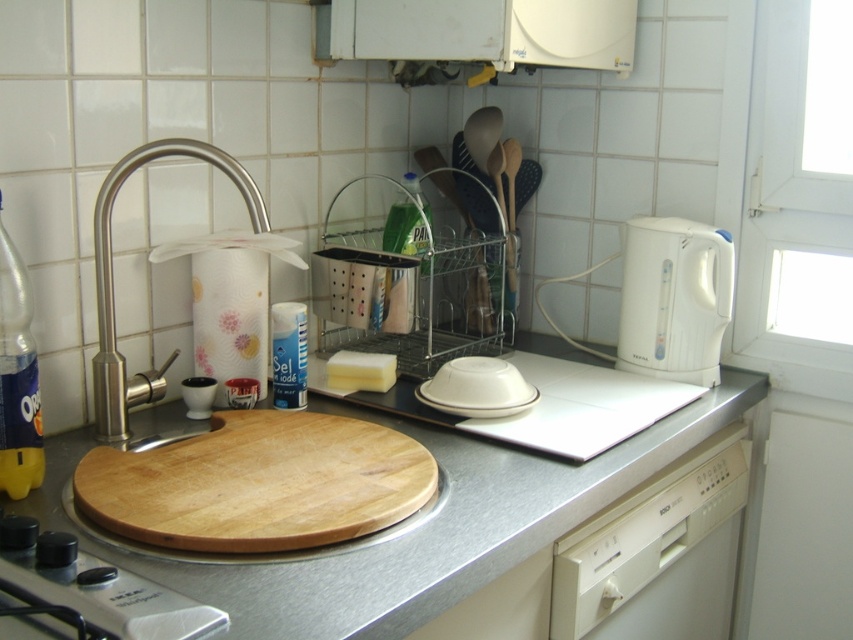
Question: Which of the following is the closest to the observer?

Choices:
 (A) white glossy plate at center
 (B) white plastic exhaust hood at upper center
 (C) brushed metal faucet at left
 (D) white plastic kettle at right

Answer: (C)

Question: Can you confirm if wooden cutting board at center is positioned above white plastic dishwasher at lower right?

Choices:
 (A) no
 (B) yes

Answer: (B)

Question: Does white plastic exhaust hood at upper center appear over white plastic kettle at right?

Choices:
 (A) yes
 (B) no

Answer: (A)

Question: Estimate the real-world distances between objects in this image. Which object is farther from the white plastic exhaust hood at upper center?

Choices:
 (A) white plastic kettle at right
 (B) natural wood cutting board at center

Answer: (B)

Question: Is white plastic kettle at right thinner than white glossy plate at center?

Choices:
 (A) no
 (B) yes

Answer: (B)

Question: Which point appears closest to the camera in this image?

Choices:
 (A) (677, 227)
 (B) (469, 406)
 (C) (515, 467)
 (D) (537, 38)

Answer: (C)